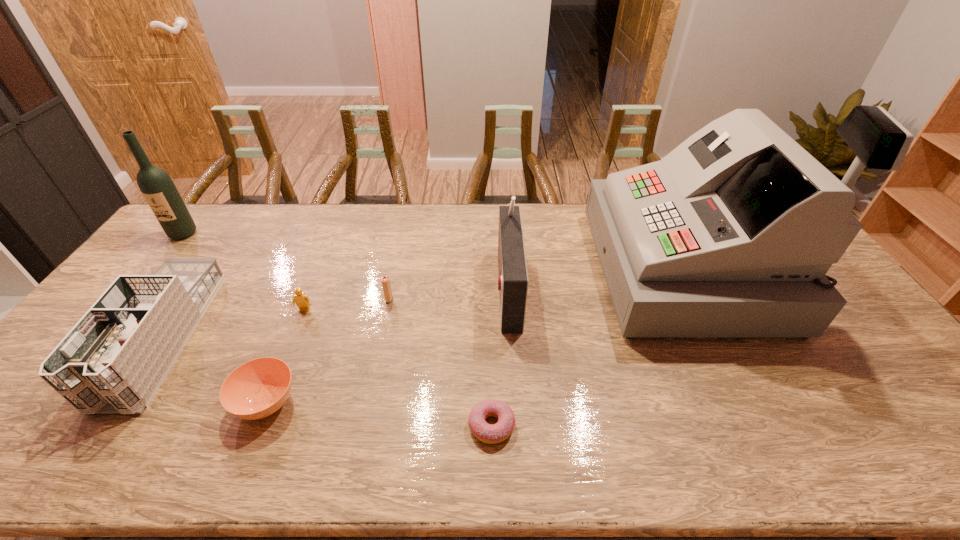
Identify the location of vacant area located on the right of the soup bowl. (415, 402).

The height and width of the screenshot is (540, 960). What are the coordinates of `free spot located 0.100m on the back of the shortest object` in the screenshot? It's located at (491, 371).

You are a GUI agent. You are given a task and a screenshot of the screen. Output one action in this format:
    pyautogui.click(x=<x>, y=<y>)
    Task: Click on the cash register present at the far edge
    This screenshot has width=960, height=540.
    Given the screenshot: What is the action you would take?
    pyautogui.click(x=731, y=234)

The width and height of the screenshot is (960, 540). Identify the location of wine bottle that is at the far edge. (157, 187).

Where is `soup bowl present at the near edge`? This screenshot has height=540, width=960. soup bowl present at the near edge is located at coordinates (258, 388).

In order to click on doughnut that is at the near edge in this screenshot , I will do `click(491, 434)`.

This screenshot has height=540, width=960. Identify the location of wine bottle that is at the left edge. coord(157,187).

Identify the location of dollhouse present at the left edge. [x=113, y=361].

The height and width of the screenshot is (540, 960). I want to click on object present at the right edge, so click(731, 234).

The width and height of the screenshot is (960, 540). Identify the location of object positioned at the far left corner. (157, 187).